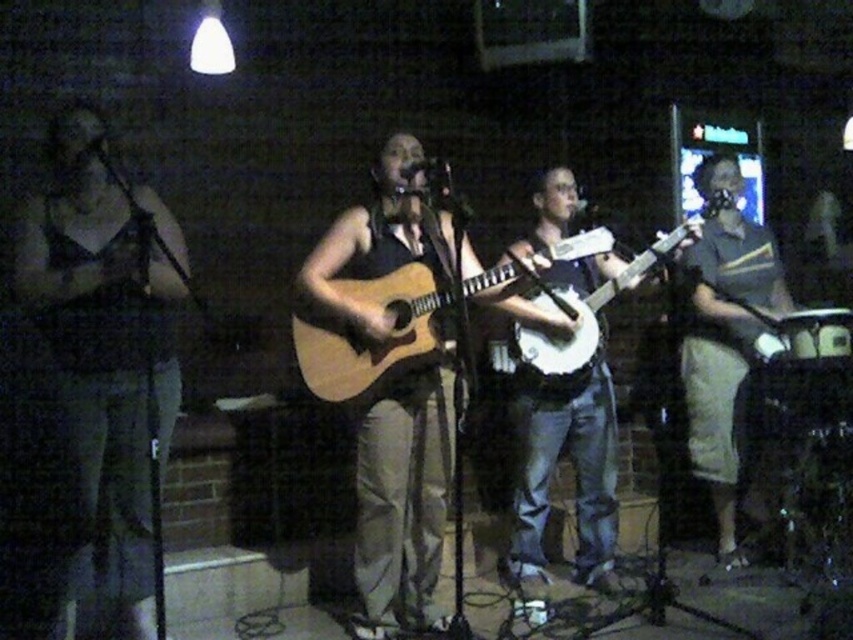
Question: Which of the following is the farthest from the observer?

Choices:
 (A) (733, 211)
 (B) (614, 288)
 (C) (108, 518)
 (D) (548, 401)

Answer: (A)

Question: Does matte black tank top at left lie behind beige fabric skirt at right?

Choices:
 (A) yes
 (B) no

Answer: (B)

Question: Is light brown acoustic guitar at center smaller than white wood banjo at center?

Choices:
 (A) yes
 (B) no

Answer: (B)

Question: Is beige fabric skirt at right further to the viewer compared to light brown acoustic guitar at center?

Choices:
 (A) no
 (B) yes

Answer: (B)

Question: Which object is closer to the camera taking this photo?

Choices:
 (A) beige fabric skirt at right
 (B) matte black tank top at left
 (C) white wood banjo at center

Answer: (B)

Question: Which of the following is the closest to the observer?

Choices:
 (A) (561, 236)
 (B) (766, 250)
 (C) (410, 282)
 (D) (670, 243)

Answer: (C)